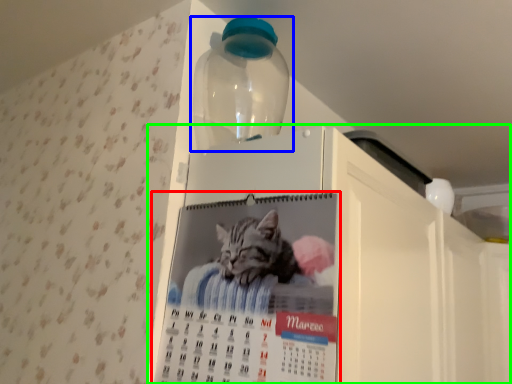
Question: Which is nearer to the poster (highlighted by a red box)? bottle (highlighted by a blue box) or appliance (highlighted by a green box).

Choices:
 (A) bottle
 (B) appliance

Answer: (B)